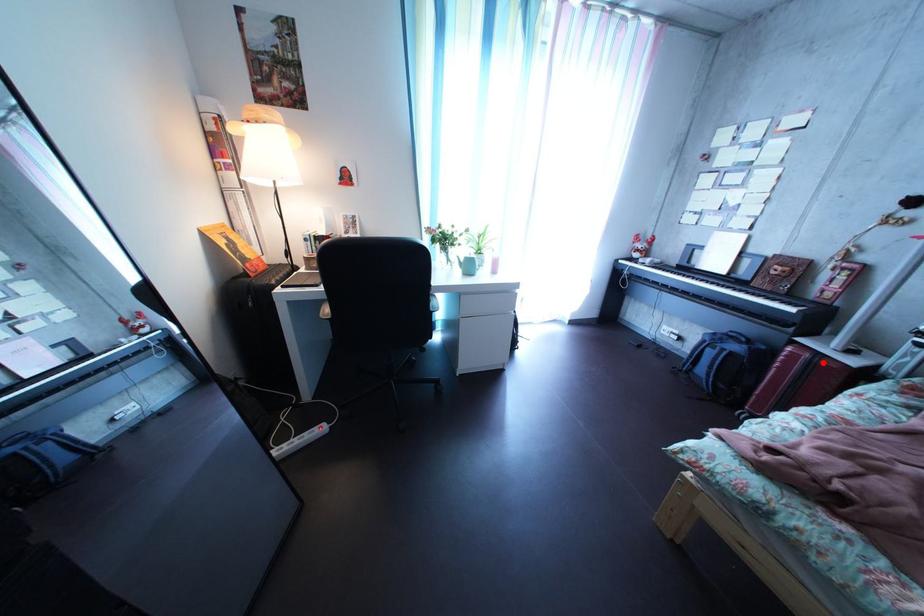
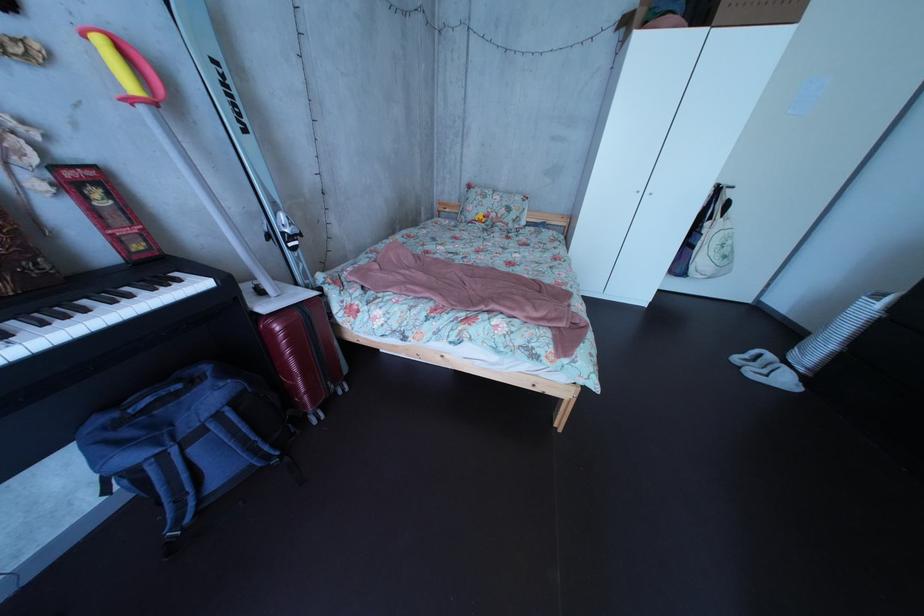
The point at the highlighted location is marked in the first image. Where is the corresponding point in the second image?

(311, 322)